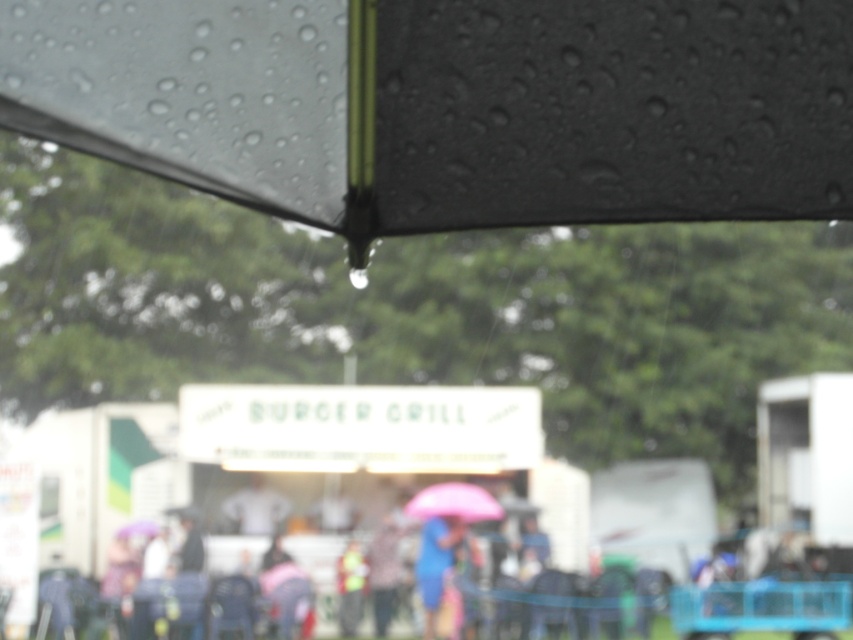
Question: Does black matte umbrella at upper center have a smaller size compared to blue fabric umbrella at center?

Choices:
 (A) yes
 (B) no

Answer: (A)

Question: Among these objects, which one is nearest to the camera?

Choices:
 (A) blue fabric umbrella at center
 (B) black matte umbrella at upper center

Answer: (B)

Question: Can you confirm if black matte umbrella at upper center is thinner than blue fabric umbrella at center?

Choices:
 (A) yes
 (B) no

Answer: (B)

Question: Which object is the closest to the black matte umbrella at upper center?

Choices:
 (A) blue fabric umbrella at center
 (B) pink matte umbrella at center

Answer: (B)

Question: Where is black matte umbrella at upper center located in relation to pink matte umbrella at center in the image?

Choices:
 (A) right
 (B) left

Answer: (B)

Question: Which of the following is the farthest from the observer?

Choices:
 (A) (350, 42)
 (B) (473, 486)

Answer: (B)